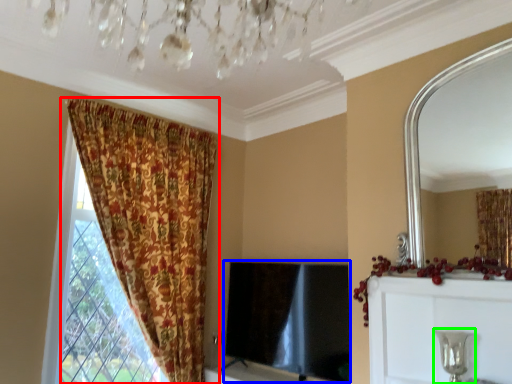
Question: Considering the real-world distances, which object is farthest from curtain (highlighted by a red box)? window screen (highlighted by a blue box) or candle holder (highlighted by a green box)?

Choices:
 (A) window screen
 (B) candle holder

Answer: (B)